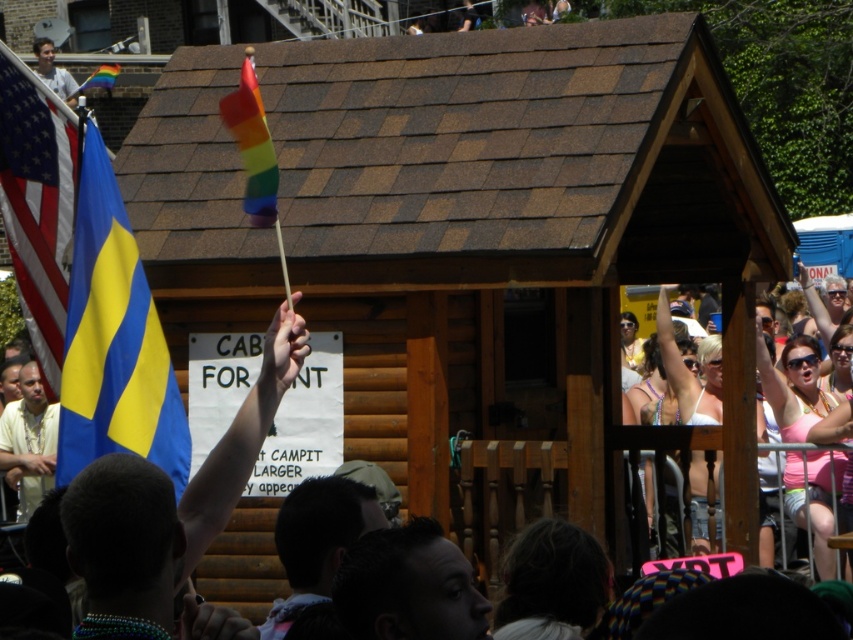
Question: Can you confirm if matte white shirt at upper left is positioned below rainbow fabric flag at upper left?

Choices:
 (A) yes
 (B) no

Answer: (B)

Question: Which object appears closest to the camera in this image?

Choices:
 (A) american flag at left
 (B) blue/yellow fabric flag at left

Answer: (B)

Question: Which of these objects is positioned closest to the blue/yellow fabric flag at left?

Choices:
 (A) rainbow fabric flag at upper center
 (B) brown wooden hut at center

Answer: (A)

Question: Does brown wooden hut at center have a larger size compared to rainbow fabric flag at upper center?

Choices:
 (A) no
 (B) yes

Answer: (B)

Question: Can you confirm if brown wooden hut at center is smaller than blue/yellow fabric flag at left?

Choices:
 (A) yes
 (B) no

Answer: (B)

Question: Based on their relative distances, which object is nearer to the rainbow fabric flag at upper left?

Choices:
 (A) matte white shirt at upper left
 (B) american flag at left
 (C) blue/yellow fabric flag at left

Answer: (A)